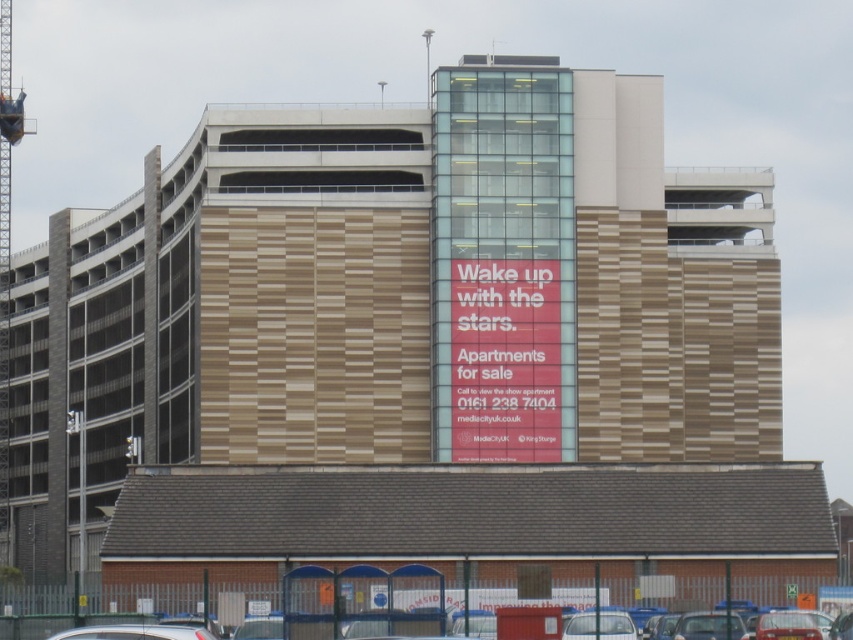
Is red matte sign at center wider than metallic gray crane at left?

Incorrect, red matte sign at center's width does not surpass metallic gray crane at left's.

Which is more to the right, red matte sign at center or metallic gray crane at left?

From the viewer's perspective, red matte sign at center appears more on the right side.

Which is in front, point (489, 280) or point (10, 550)?

Positioned in front is point (489, 280).

Where is `red matte sign at center`? The width and height of the screenshot is (853, 640). red matte sign at center is located at coordinates (505, 358).

Is red matte sign at center further to the viewer compared to silver metallic car at lower left?

Yes, red matte sign at center is further from the viewer.

At what (x,y) coordinates should I click in order to perform the action: click on red matte sign at center. Please return your answer as a coordinate pair (x, y). The image size is (853, 640). Looking at the image, I should click on (505, 358).

Locate an element on the screen. This screenshot has width=853, height=640. red matte sign at center is located at coordinates (505, 358).

Does metallic gray crane at left appear on the left side of silver metallic car at lower left?

Yes, metallic gray crane at left is to the left of silver metallic car at lower left.

Does metallic gray crane at left appear under silver metallic car at lower left?

No.

Between point (9, 112) and point (97, 630), which one is positioned behind?

The point (9, 112) is more distant.

Identify the location of metallic gray crane at left. (4, 259).